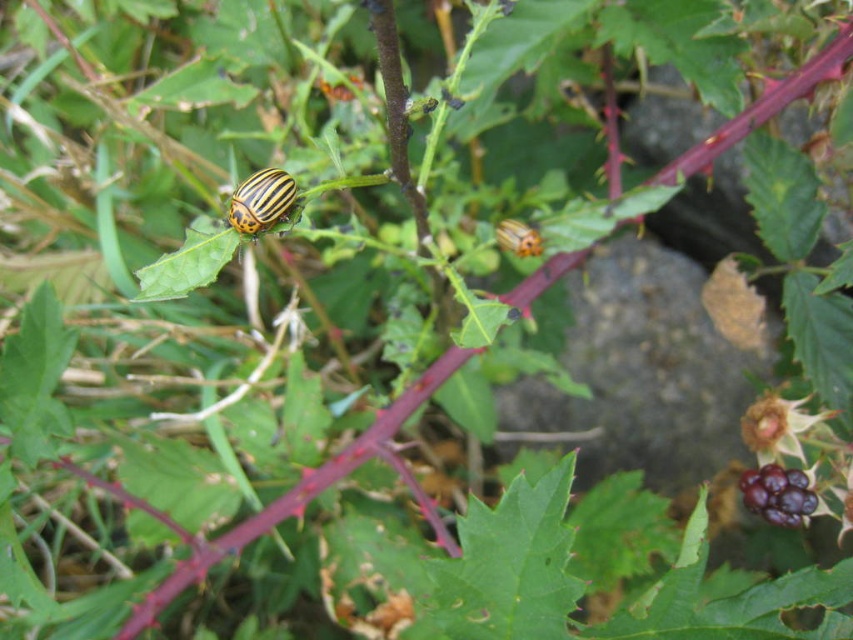
Question: Which of the following is the closest to the observer?

Choices:
 (A) (201, 259)
 (B) (238, 227)
 (C) (509, 241)
 (D) (778, 477)

Answer: (A)

Question: Which of these objects is positioned closest to the green matte leaf at center?

Choices:
 (A) yellow striped beetle at center
 (B) yellow-orange striped beetle at center

Answer: (B)

Question: Can you confirm if yellow-orange striped beetle at center is bigger than yellow striped beetle at center?

Choices:
 (A) no
 (B) yes

Answer: (B)

Question: Considering the real-world distances, which object is closest to the yellow striped beetle at center?

Choices:
 (A) shiny purple berry at lower right
 (B) yellow-orange striped beetle at center

Answer: (A)

Question: Does green matte leaf at center appear on the right side of yellow-orange striped beetle at center?

Choices:
 (A) yes
 (B) no

Answer: (B)

Question: Is green matte leaf at center wider than yellow-orange striped beetle at center?

Choices:
 (A) no
 (B) yes

Answer: (B)